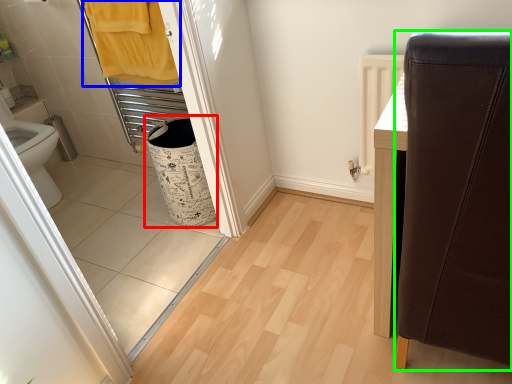
Question: Which is nearer to the laundry basket (highlighted by a red box)? bath towel (highlighted by a blue box) or furniture (highlighted by a green box).

Choices:
 (A) bath towel
 (B) furniture

Answer: (A)